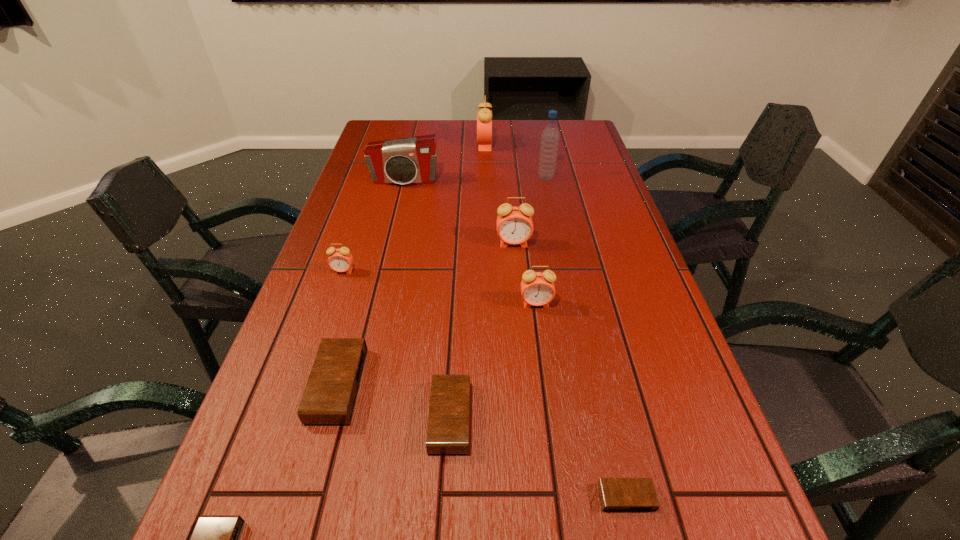
Identify the location of the fifth shortest alarm clock. (340, 260).

You are a GUI agent. You are given a task and a screenshot of the screen. Output one action in this format:
    pyautogui.click(x=<x>, y=<y>)
    Task: Click on the seventh tallest object
    This screenshot has height=540, width=960.
    Given the screenshot: What is the action you would take?
    pyautogui.click(x=330, y=395)

Find the location of `the third black alarm clock from right to left`. the third black alarm clock from right to left is located at coordinates (330, 395).

Locate an element on the screen. the third black alarm clock from left to right is located at coordinates [x=449, y=411].

This screenshot has height=540, width=960. I want to click on the fourth alarm clock from left to right, so click(x=449, y=411).

Where is `the shortest alarm clock`? the shortest alarm clock is located at coordinates (616, 494).

Locate an element on the screen. the rightmost black alarm clock is located at coordinates (616, 494).

Locate an element on the screen. The width and height of the screenshot is (960, 540). vacant space situated 0.200m on the left of the water bottle is located at coordinates [x=478, y=178].

Locate an element on the screen. free spot located on the face of the farthest pink alarm clock is located at coordinates (427, 145).

At what (x,y) coordinates should I click in order to perform the action: click on vacant area situated 0.200m on the face of the farthest pink alarm clock. Please return your answer as a coordinate pair (x, y). Looking at the image, I should click on (424, 145).